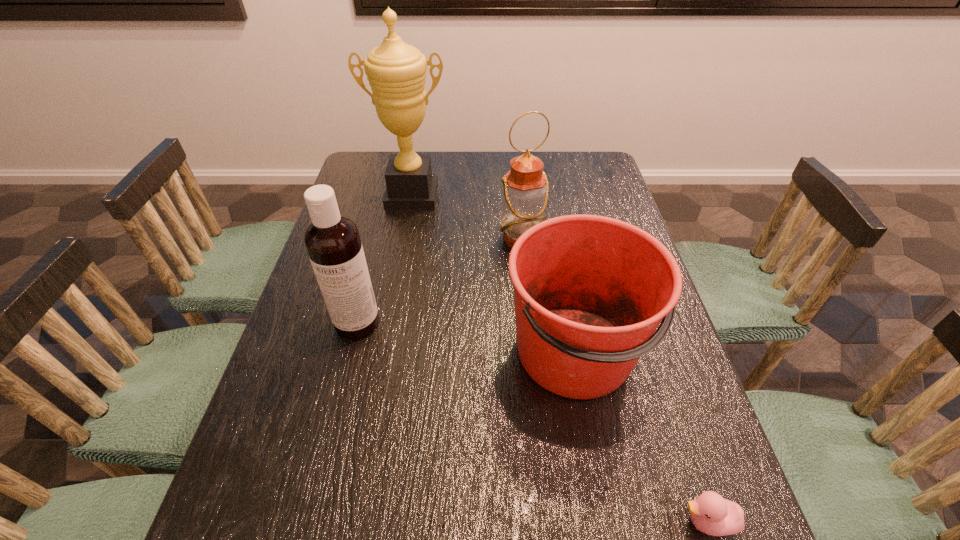
Locate an element on the screen. This screenshot has width=960, height=540. the tallest object is located at coordinates (396, 71).

The image size is (960, 540). What are the coordinates of `the farthest object` in the screenshot? It's located at (396, 71).

This screenshot has width=960, height=540. I want to click on oil lamp, so (x=525, y=192).

Identify the location of dishwasher detergent. coord(332,241).

Identify the location of the second shortest object. This screenshot has width=960, height=540. (590, 291).

You are a GUI agent. You are given a task and a screenshot of the screen. Output one action in this format:
    pyautogui.click(x=<x>, y=<y>)
    Task: Click on the vacant space located 0.390m at the front of the farthest object with handles
    The height and width of the screenshot is (540, 960).
    Given the screenshot: What is the action you would take?
    pyautogui.click(x=392, y=305)

The image size is (960, 540). I want to click on vacant space located on the left of the second farthest object, so click(x=482, y=239).

Locate an element on the screen. vacant space located on the label side of the dishwasher detergent is located at coordinates (323, 461).

Locate an element on the screen. The image size is (960, 540). vacant region located 0.060m on the front of the second shortest object is located at coordinates (594, 448).

Where is `object present at the far edge`? This screenshot has width=960, height=540. object present at the far edge is located at coordinates (396, 71).